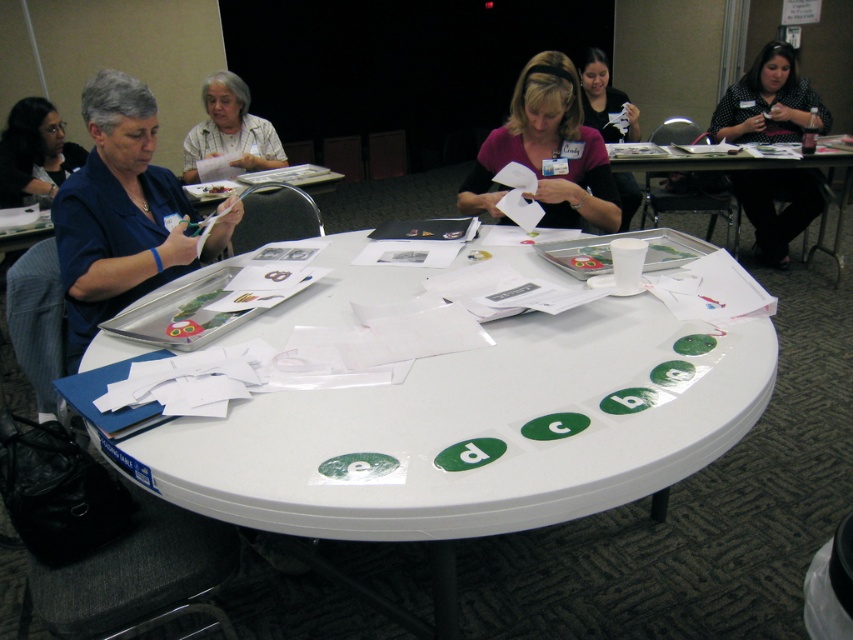
How distant is white plastic table at center from white paper at upper center?

A distance of 7.12 feet exists between white plastic table at center and white paper at upper center.

Describe the element at coordinates (477, 429) in the screenshot. I see `white plastic table at center` at that location.

Locate an element on the screen. white plastic table at center is located at coordinates (477, 429).

Image resolution: width=853 pixels, height=640 pixels. Find the location of `purple matte shirt at center`. purple matte shirt at center is located at coordinates (547, 150).

Is point (552, 93) farther from viewer compared to point (601, 129)?

That is False.

At what (x,y) coordinates should I click in order to perform the action: click on purple matte shirt at center. Please return your answer as a coordinate pair (x, y). This screenshot has width=853, height=640. Looking at the image, I should click on (547, 150).

Which is more to the right, purple matte shirt at center or white paper at center?

white paper at center

Identify the location of purple matte shirt at center. The width and height of the screenshot is (853, 640). 547,150.